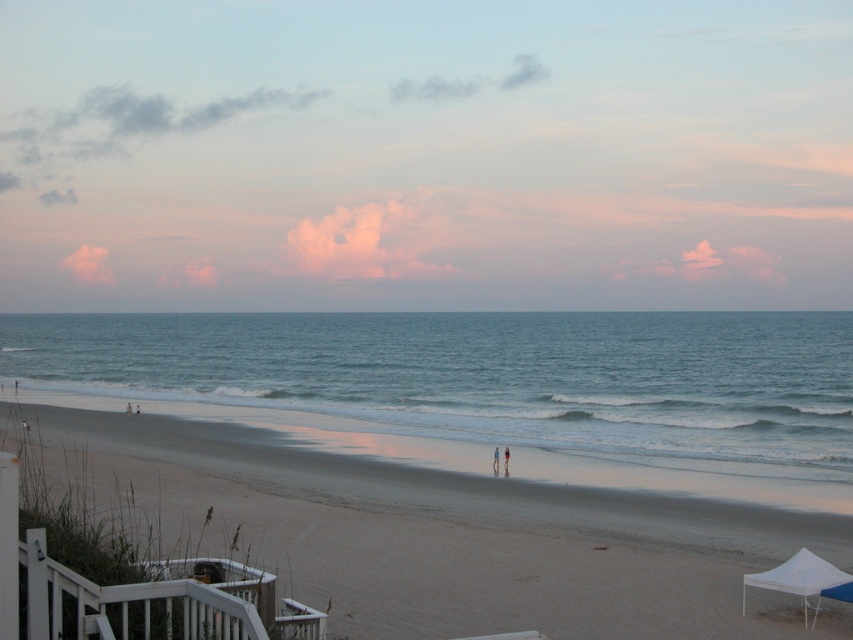
From the picture: You are standing on the sandy beach at lower center and want to walk to the white fabric tent at lower right. Which direction should you head towards?

You should head towards the upper direction because the sandy beach at lower center is positioned under the white fabric tent at lower right, meaning the tent is located above it in the image.

You are standing on the beach and want to walk from the white wooden railing at lower left to the white fabric tent at lower right. Which direction should you head towards?

Since the white wooden railing at lower left is closer to you than the white fabric tent at lower right, you should head towards the right direction to reach the tent.

You are standing at the center of the beach scene. You want to walk towards the white wooden railing at lower left. Which direction should you head?

The white wooden railing at lower left is located at point (134, 593), so you should head towards the lower left direction to reach it.